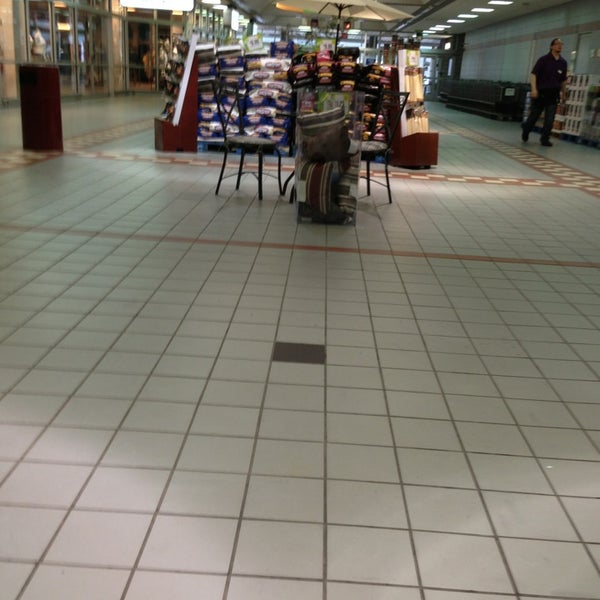
The width and height of the screenshot is (600, 600). In order to click on white tiled floor with dark grout in this screenshot , I will do `click(248, 335)`.